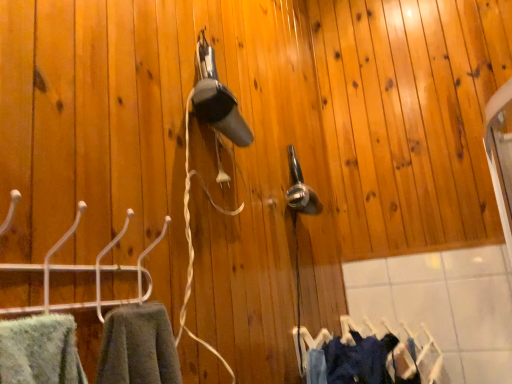
Question: Is denim fabric clothes at lower right taller than white plastic hanger at left?

Choices:
 (A) no
 (B) yes

Answer: (B)

Question: Does denim fabric clothes at lower right have a lesser height compared to white plastic hanger at left?

Choices:
 (A) yes
 (B) no

Answer: (B)

Question: Can you confirm if denim fabric clothes at lower right is positioned to the left of white plastic hanger at left?

Choices:
 (A) no
 (B) yes

Answer: (A)

Question: Is white plastic hanger at left located within denim fabric clothes at lower right?

Choices:
 (A) no
 (B) yes

Answer: (A)

Question: Would you say denim fabric clothes at lower right is outside white plastic hanger at left?

Choices:
 (A) yes
 (B) no

Answer: (A)

Question: Is denim fabric clothes at lower right aimed at white plastic hanger at left?

Choices:
 (A) no
 (B) yes

Answer: (A)

Question: Considering the relative sizes of denim fabric clothes at lower right and dark blue fabric at lower right in the image provided, is denim fabric clothes at lower right thinner than dark blue fabric at lower right?

Choices:
 (A) no
 (B) yes

Answer: (A)

Question: Is denim fabric clothes at lower right aimed at dark blue fabric at lower right?

Choices:
 (A) no
 (B) yes

Answer: (A)

Question: Considering the relative positions of denim fabric clothes at lower right and dark blue fabric at lower right in the image provided, is denim fabric clothes at lower right to the right of dark blue fabric at lower right from the viewer's perspective?

Choices:
 (A) yes
 (B) no

Answer: (A)

Question: Does denim fabric clothes at lower right have a greater height compared to dark blue fabric at lower right?

Choices:
 (A) no
 (B) yes

Answer: (B)

Question: Is denim fabric clothes at lower right to the left of dark blue fabric at lower right from the viewer's perspective?

Choices:
 (A) no
 (B) yes

Answer: (A)

Question: Is denim fabric clothes at lower right closer to the viewer compared to dark blue fabric at lower right?

Choices:
 (A) yes
 (B) no

Answer: (B)

Question: Is white plastic hanger at left beside denim fabric clothes at lower right?

Choices:
 (A) no
 (B) yes

Answer: (A)